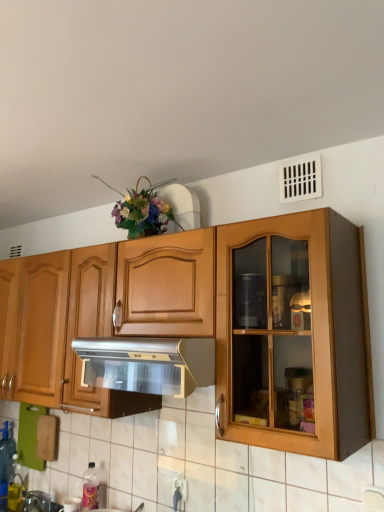
Question: Does white plastic vent at upper right have a greater width compared to pink plastic bottle at lower left, placed as the 1th bottle when sorted from right to left?

Choices:
 (A) yes
 (B) no

Answer: (B)

Question: From a real-world perspective, is white plastic vent at upper right positioned over pink plastic bottle at lower left, which ranks as the second bottle in left-to-right order, based on gravity?

Choices:
 (A) no
 (B) yes

Answer: (B)

Question: Does white plastic vent at upper right turn towards pink plastic bottle at lower left, the 1th bottle viewed from the front?

Choices:
 (A) no
 (B) yes

Answer: (A)

Question: Does white plastic vent at upper right have a lesser height compared to pink plastic bottle at lower left, arranged as the 2th bottle when viewed from the back?

Choices:
 (A) yes
 (B) no

Answer: (A)

Question: Considering the relative sizes of white plastic vent at upper right and pink plastic bottle at lower left, arranged as the 2th bottle when viewed from the back, in the image provided, is white plastic vent at upper right thinner than pink plastic bottle at lower left, arranged as the 2th bottle when viewed from the back,?

Choices:
 (A) no
 (B) yes

Answer: (B)

Question: Is pink plastic bottle at lower left, arranged as the 2th bottle when viewed from the back, a part of white plastic vent at upper right?

Choices:
 (A) yes
 (B) no

Answer: (B)

Question: Can you confirm if silver metallic range hood at center is taller than white plastic vent at upper right?

Choices:
 (A) yes
 (B) no

Answer: (A)

Question: Does silver metallic range hood at center come in front of white plastic vent at upper right?

Choices:
 (A) yes
 (B) no

Answer: (A)

Question: Is silver metallic range hood at center outside of white plastic vent at upper right?

Choices:
 (A) yes
 (B) no

Answer: (A)

Question: Does silver metallic range hood at center have a lesser height compared to white plastic vent at upper right?

Choices:
 (A) no
 (B) yes

Answer: (A)

Question: Can you confirm if silver metallic range hood at center is positioned to the left of white plastic vent at upper right?

Choices:
 (A) yes
 (B) no

Answer: (A)

Question: Could white plastic vent at upper right be considered to be inside silver metallic range hood at center?

Choices:
 (A) yes
 (B) no

Answer: (B)

Question: Are silver metallic range hood at center and pink plastic bottle at lower left, the 1th bottle viewed from the front, making contact?

Choices:
 (A) yes
 (B) no

Answer: (B)